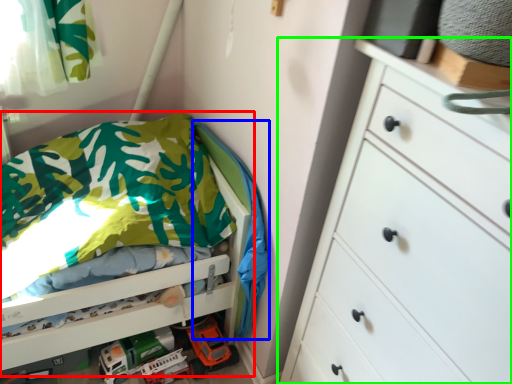
Question: Considering the real-world distances, which object is closest to bed (highlighted by a red box)? blanket (highlighted by a blue box) or chest of drawers (highlighted by a green box).

Choices:
 (A) blanket
 (B) chest of drawers

Answer: (A)